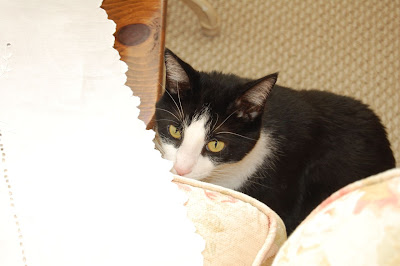
Find the location of a particular element. Image resolution: width=400 pixels, height=266 pixels. cushions is located at coordinates pyautogui.click(x=354, y=231), pyautogui.click(x=238, y=220).